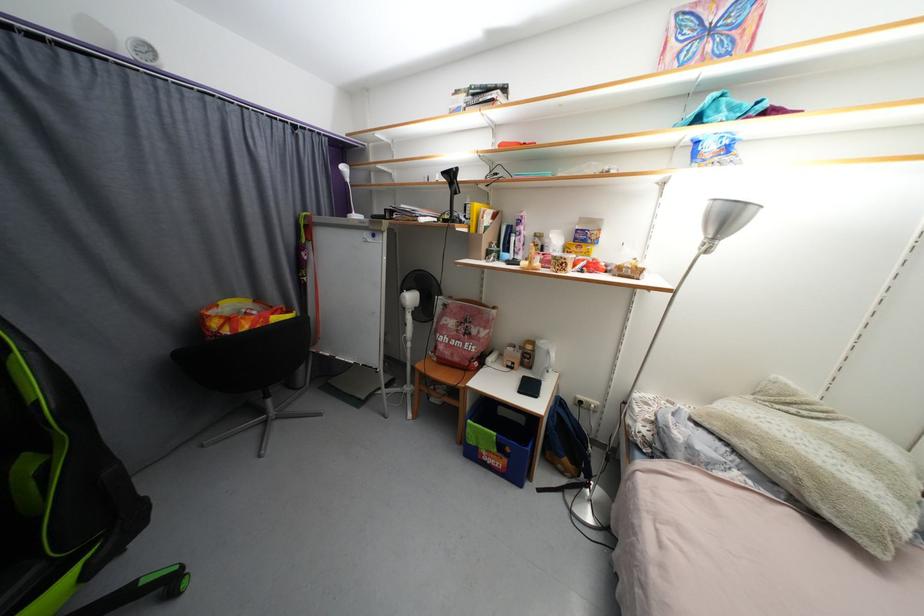
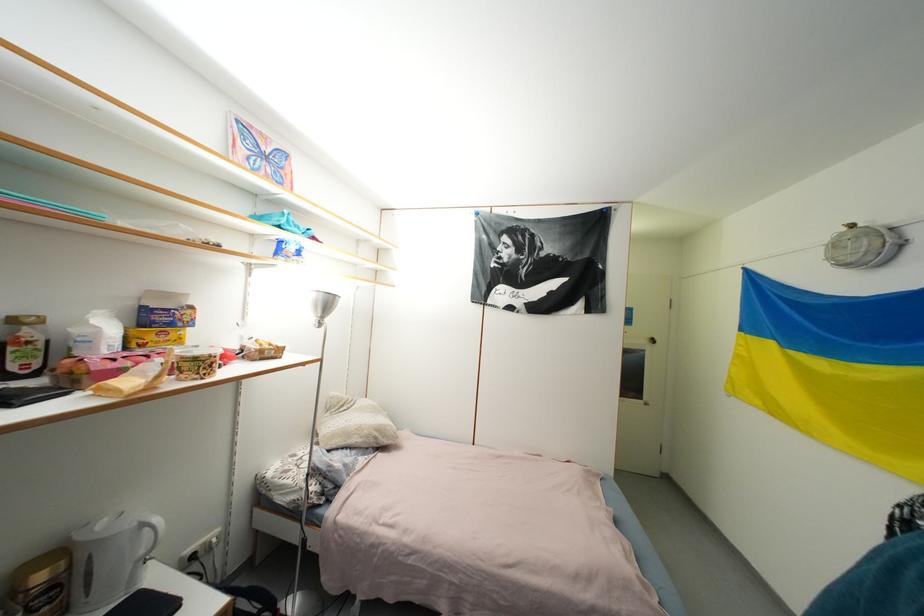
Question: The camera is either moving clockwise (left) or counter-clockwise (right) around the object. The first image is from the beginning of the video and the second image is from the end. Is the camera moving left or right when shooting the video?

Choices:
 (A) Left
 (B) Right

Answer: (A)